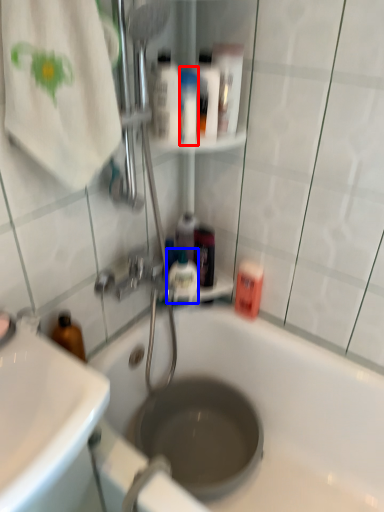
Question: Which object is closer to the camera taking this photo, toiletry (highlighted by a red box) or mouthwash (highlighted by a blue box)?

Choices:
 (A) toiletry
 (B) mouthwash

Answer: (A)